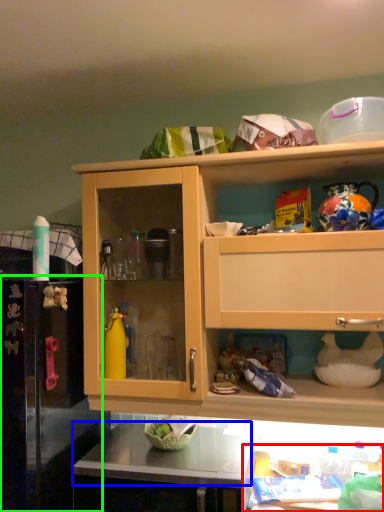
Question: Which is nearer to the table (highlighted by a red box)? counter top (highlighted by a blue box) or appliance (highlighted by a green box).

Choices:
 (A) counter top
 (B) appliance

Answer: (A)